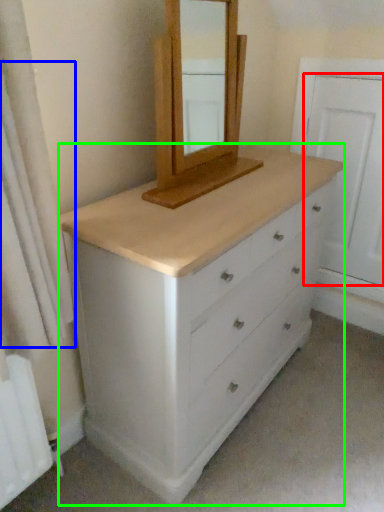
Question: Based on their relative distances, which object is farther from screen door (highlighted by a red box)? Choose from shower curtain (highlighted by a blue box) and chest of drawers (highlighted by a green box).

Choices:
 (A) shower curtain
 (B) chest of drawers

Answer: (A)